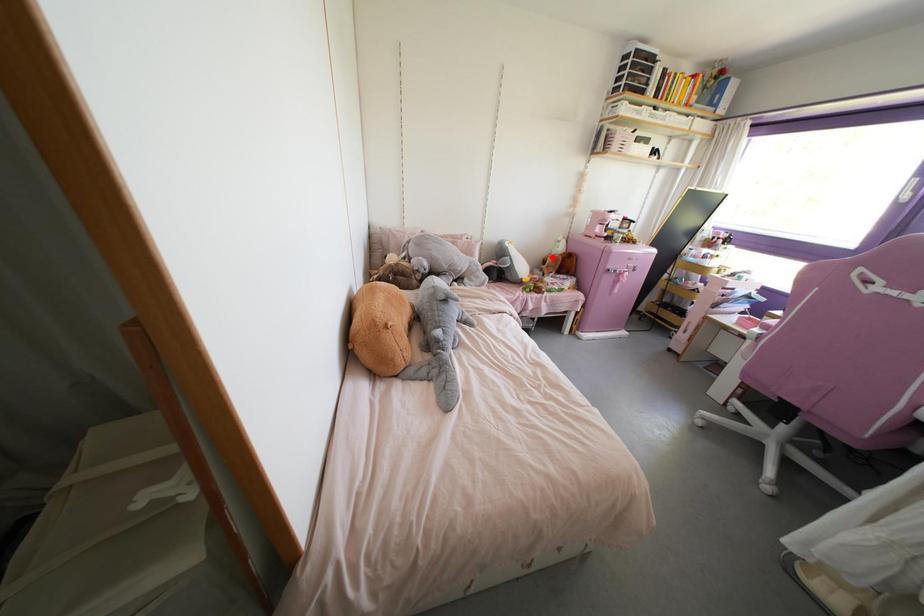
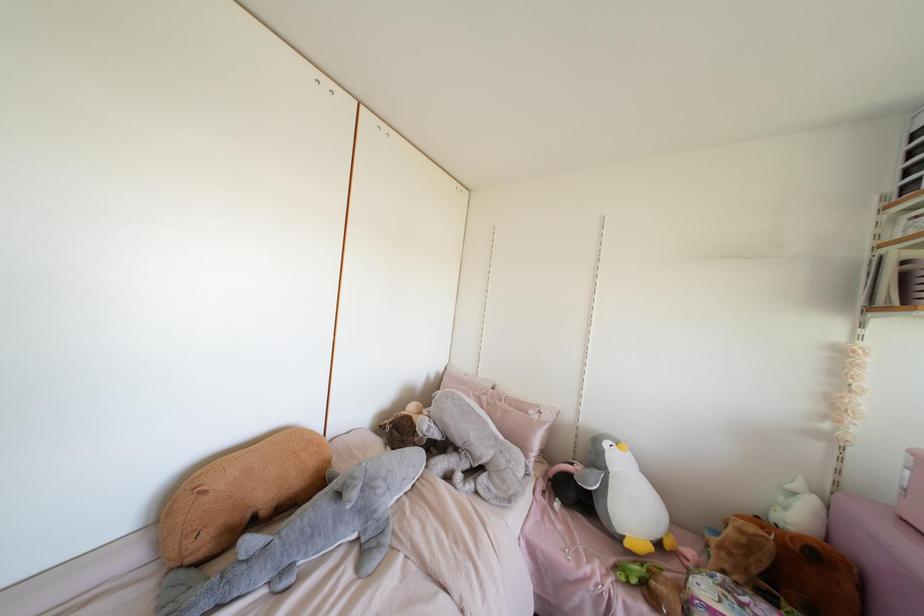
Question: I am providing you with two images of the same scene from different viewpoints. Image1 has a red point marked. In image2, the corresponding 3D location appears at what relative position? Reply with the corresponding letter.

Choices:
 (A) Closer
 (B) Farther

Answer: (B)